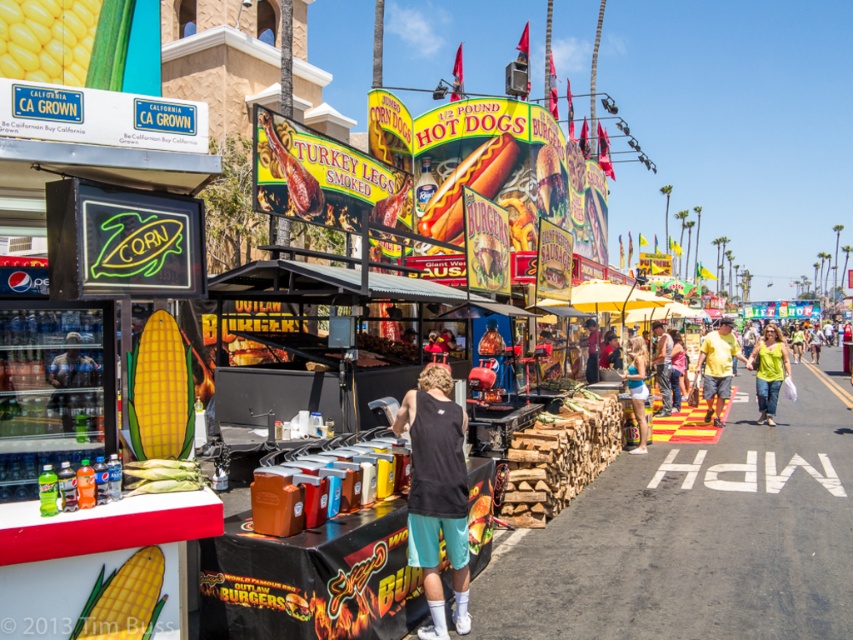
You are a photographer standing at the entrance of the food market. You want to take a clear photo of the black cotton tank top at center without any obstructions. Considering your current position, is the tank top within a comfortable shooting distance for a standard camera lens? Explain your reasoning.

The black cotton tank top at center is 16.52 feet away from the camera. A standard camera lens typically has a comfortable shooting distance between 8 to 15 feet for clear, unobstructed photos. Since 16.52 feet exceeds this range, the tank top may be slightly out of the optimal range, but still within reach with a zoom lens. However, you might need to adjust your position or use a longer focal length to capture it clearly without obstructions.

You are a customer at the food market and want to ask the person behind the counter for a hot dog. Which clothing item is closer to your left side when facing the counter? The black cotton tank top at center or the yellow cotton shirt at center?

The black cotton tank top at center is to the left of the yellow cotton shirt at center, so the black cotton tank top at center is closer to your left side when facing the counter.